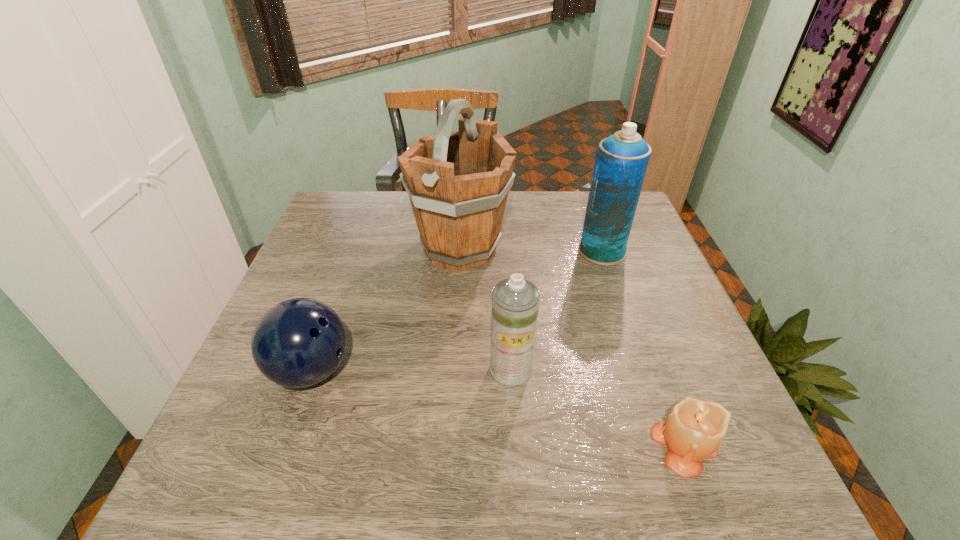
At what (x,y) coordinates should I click in order to perform the action: click on blank area located 0.190m on the front of the taller aerosol can. Please return your answer as a coordinate pair (x, y). The height and width of the screenshot is (540, 960). Looking at the image, I should click on (625, 319).

At what (x,y) coordinates should I click in order to perform the action: click on free region located on the left of the third tallest object. Please return your answer as a coordinate pair (x, y). Looking at the image, I should click on (421, 369).

The image size is (960, 540). In order to click on vacant area located 0.390m on the surface of the leftmost object near the finger holes in this screenshot , I will do `click(544, 370)`.

Locate an element on the screen. This screenshot has width=960, height=540. vacant area located on the back of the nearest object is located at coordinates (636, 314).

Find the location of a particular element. Image resolution: width=960 pixels, height=540 pixels. object present at the far edge is located at coordinates (458, 182).

The image size is (960, 540). In order to click on object present at the near edge in this screenshot , I will do `click(693, 431)`.

You are a GUI agent. You are given a task and a screenshot of the screen. Output one action in this format:
    pyautogui.click(x=<x>, y=<y>)
    Task: Click on the object that is at the left edge
    Image resolution: width=960 pixels, height=540 pixels.
    Given the screenshot: What is the action you would take?
    pyautogui.click(x=297, y=343)

Locate an element on the screen. The height and width of the screenshot is (540, 960). aerosol can that is positioned at the right edge is located at coordinates (621, 161).

At what (x,y) coordinates should I click in order to perform the action: click on candle that is at the right edge. Please return your answer as a coordinate pair (x, y). Looking at the image, I should click on click(x=693, y=431).

Find the location of a particular element. Image resolution: width=960 pixels, height=540 pixels. object that is positioned at the near right corner is located at coordinates (693, 431).